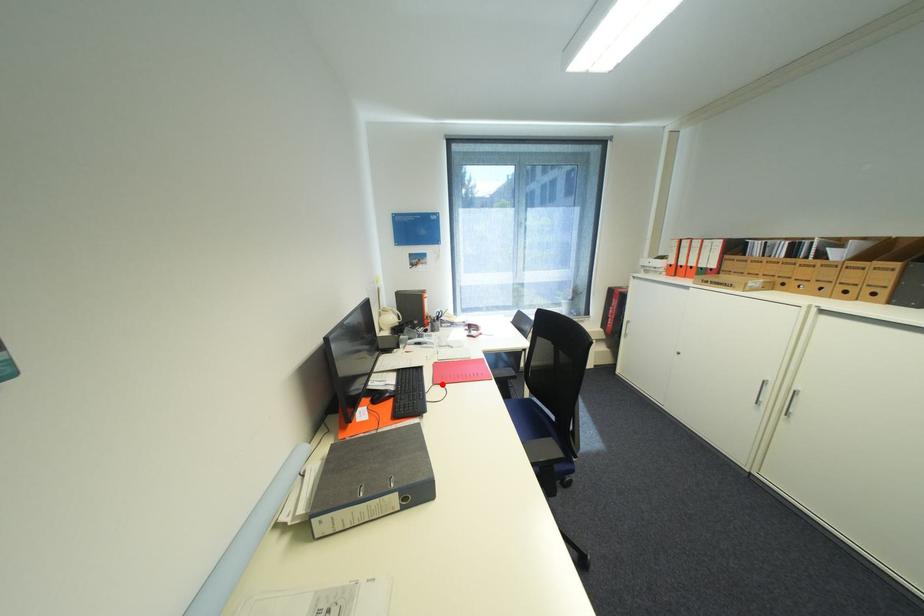
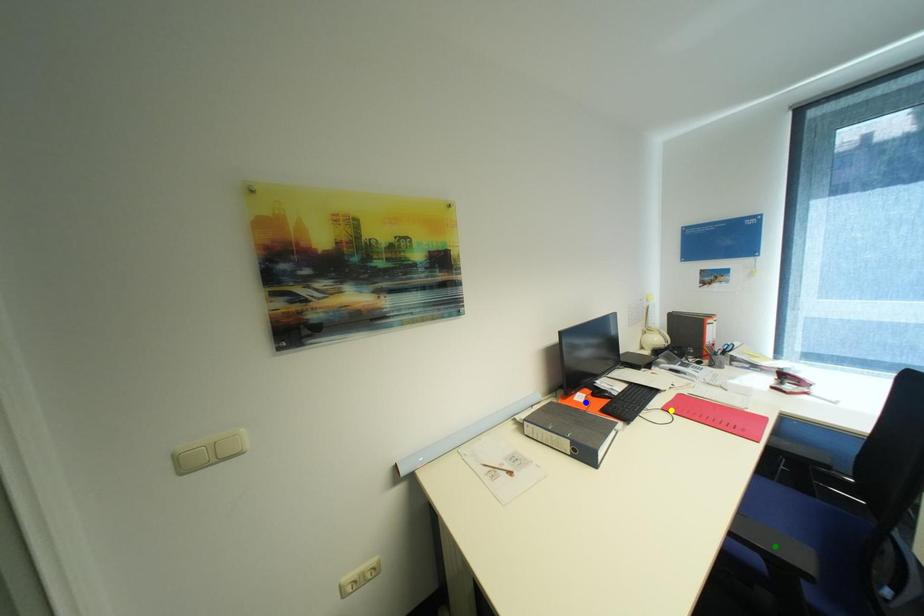
Question: I am providing you with two images of the same scene from different viewpoints. A red point is marked on the first image. You are given multiple points on the second image. Which point in image 2 represents the same 3d spot as the red point in image 1?

Choices:
 (A) blue point
 (B) yellow point
 (C) green point

Answer: (B)